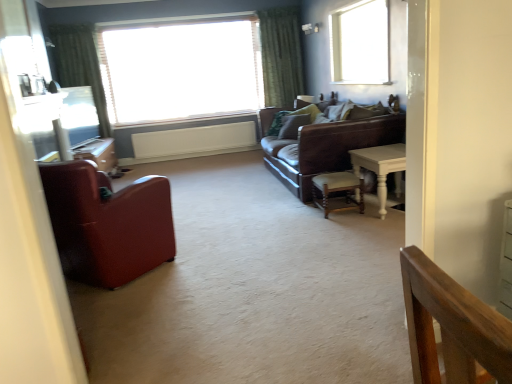
Question: Does white wooden table at right have a larger size compared to white plastic radiator at center?

Choices:
 (A) yes
 (B) no

Answer: (A)

Question: Does white wooden table at right have a greater width compared to white plastic radiator at center?

Choices:
 (A) yes
 (B) no

Answer: (A)

Question: From the image's perspective, is white wooden table at right located above white plastic radiator at center?

Choices:
 (A) yes
 (B) no

Answer: (B)

Question: Are white wooden table at right and white plastic radiator at center making contact?

Choices:
 (A) no
 (B) yes

Answer: (A)

Question: Is white wooden table at right thinner than white plastic radiator at center?

Choices:
 (A) no
 (B) yes

Answer: (A)

Question: Can you confirm if white wooden table at right is shorter than white plastic radiator at center?

Choices:
 (A) no
 (B) yes

Answer: (A)

Question: From the image's perspective, does green textured curtain at upper center, positioned as the 1th curtain in right-to-left order, appear higher than wooden chair at center, the 2th chair from the front?

Choices:
 (A) no
 (B) yes

Answer: (B)

Question: Is wooden chair at center, the 2th chair from the front, completely or partially inside green textured curtain at upper center, positioned as the 1th curtain in right-to-left order?

Choices:
 (A) no
 (B) yes

Answer: (A)

Question: Is the position of green textured curtain at upper center, positioned as the 1th curtain in right-to-left order, more distant than that of wooden chair at center, the 2th chair from the front?

Choices:
 (A) no
 (B) yes

Answer: (B)

Question: From a real-world perspective, is green textured curtain at upper center, positioned as the 1th curtain in right-to-left order, positioned over wooden chair at center, which ranks as the first chair in back-to-front order, based on gravity?

Choices:
 (A) no
 (B) yes

Answer: (B)

Question: Is green textured curtain at upper center, positioned as the 1th curtain in right-to-left order, placed right next to wooden chair at center, which is the second chair from left to right?

Choices:
 (A) no
 (B) yes

Answer: (A)

Question: Is green textured curtain at upper center, the second curtain in the left-to-right sequence, aimed at wooden chair at center, which is the second chair from left to right?

Choices:
 (A) no
 (B) yes

Answer: (B)

Question: Is green textured curtain at upper center, positioned as the 1th curtain in right-to-left order, behind matte glass window screen at left?

Choices:
 (A) no
 (B) yes

Answer: (B)